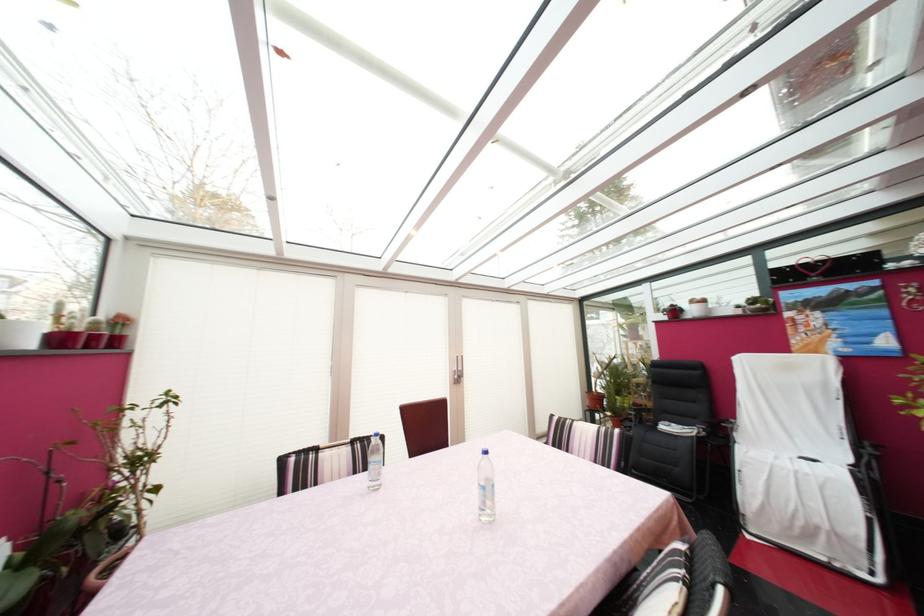
Describe the element at coordinates (869, 459) in the screenshot. I see `the chair armrest` at that location.